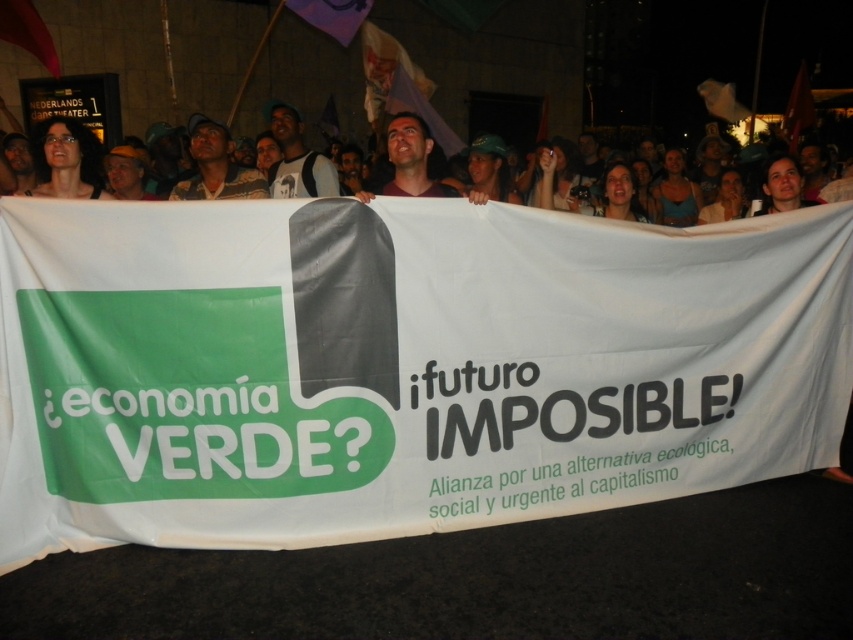
Question: Which of the following is the farthest from the observer?

Choices:
 (A) (77, 138)
 (B) (293, 124)

Answer: (B)

Question: Is matte black hair at upper left bigger than matte brown shirt at center?

Choices:
 (A) no
 (B) yes

Answer: (B)

Question: Which of the following is the closest to the observer?

Choices:
 (A) (97, 173)
 (B) (418, 148)

Answer: (B)

Question: Is matte black backpack at upper center to the left of matte brown shirt at center from the viewer's perspective?

Choices:
 (A) no
 (B) yes

Answer: (B)

Question: Does matte black hair at upper left appear on the right side of matte black backpack at upper center?

Choices:
 (A) no
 (B) yes

Answer: (A)

Question: Among these objects, which one is farthest from the camera?

Choices:
 (A) matte brown shirt at center
 (B) matte black hair at upper left
 (C) matte black backpack at upper center

Answer: (C)